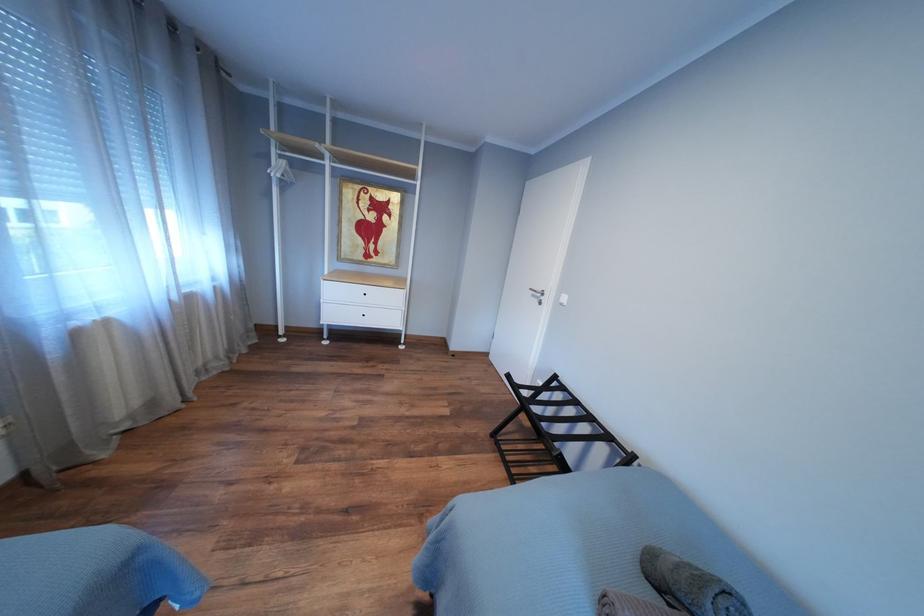
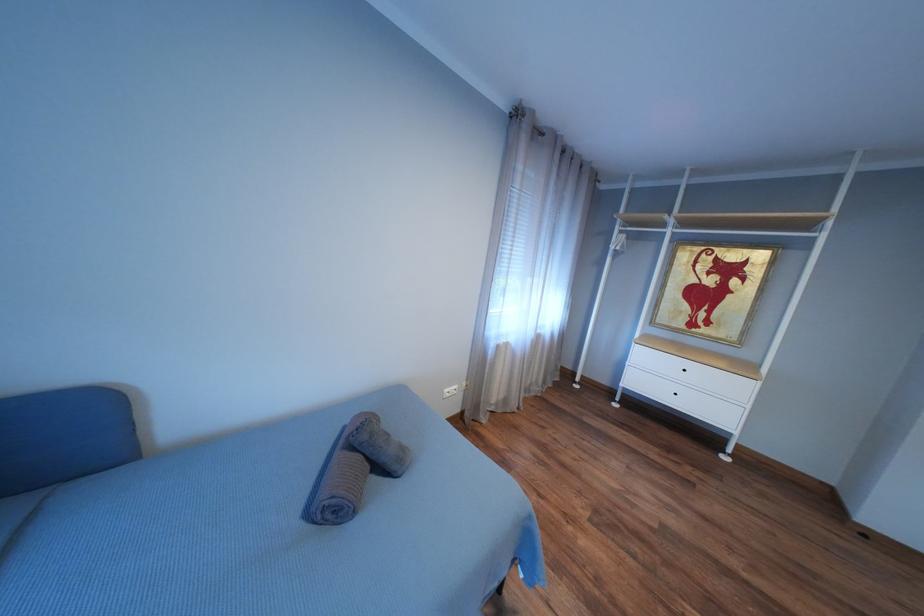
Question: The camera is either moving clockwise (left) or counter-clockwise (right) around the object. The first image is from the beginning of the video and the second image is from the end. Is the camera moving left or right when shooting the video?

Choices:
 (A) Left
 (B) Right

Answer: (B)